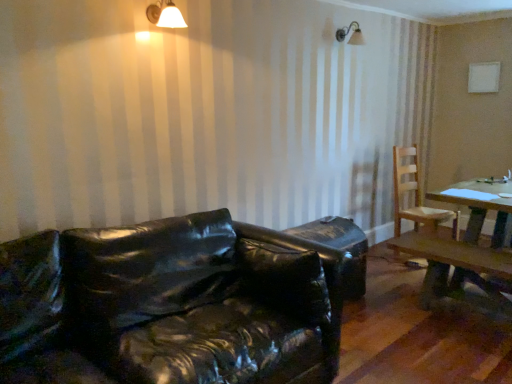
Question: Considering the relative sizes of white matte light fixture at upper center and wooden table at right in the image provided, is white matte light fixture at upper center bigger than wooden table at right?

Choices:
 (A) no
 (B) yes

Answer: (A)

Question: From a real-world perspective, is white matte light fixture at upper center under wooden table at right?

Choices:
 (A) yes
 (B) no

Answer: (B)

Question: Are white matte light fixture at upper center and wooden table at right far apart?

Choices:
 (A) yes
 (B) no

Answer: (A)

Question: Considering the relative sizes of white matte light fixture at upper center and wooden table at right in the image provided, is white matte light fixture at upper center wider than wooden table at right?

Choices:
 (A) no
 (B) yes

Answer: (A)

Question: Considering the relative sizes of white matte light fixture at upper center and wooden table at right in the image provided, is white matte light fixture at upper center shorter than wooden table at right?

Choices:
 (A) no
 (B) yes

Answer: (B)

Question: From the image's perspective, is white matte light fixture at upper center on top of wooden table at right?

Choices:
 (A) no
 (B) yes

Answer: (B)

Question: From the image's perspective, would you say white matte light fixture at upper center is positioned over glossy black leather couch at lower left?

Choices:
 (A) no
 (B) yes

Answer: (B)

Question: From the image's perspective, is white matte light fixture at upper center located beneath glossy black leather couch at lower left?

Choices:
 (A) no
 (B) yes

Answer: (A)

Question: Does white matte light fixture at upper center have a lesser height compared to glossy black leather couch at lower left?

Choices:
 (A) yes
 (B) no

Answer: (A)

Question: Does white matte light fixture at upper center contain glossy black leather couch at lower left?

Choices:
 (A) yes
 (B) no

Answer: (B)

Question: Is white matte light fixture at upper center to the right of glossy black leather couch at lower left from the viewer's perspective?

Choices:
 (A) yes
 (B) no

Answer: (B)

Question: Is white matte light fixture at upper center next to glossy black leather couch at lower left and touching it?

Choices:
 (A) yes
 (B) no

Answer: (B)

Question: Considering the relative positions of white matte light fixture at upper center and light brown wooden chair at right in the image provided, is white matte light fixture at upper center to the left of light brown wooden chair at right from the viewer's perspective?

Choices:
 (A) yes
 (B) no

Answer: (A)